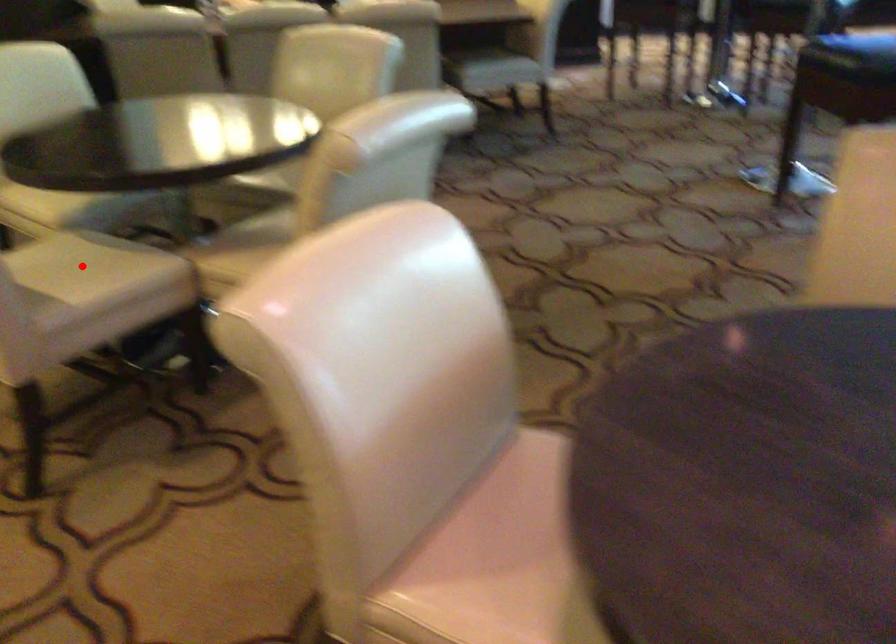
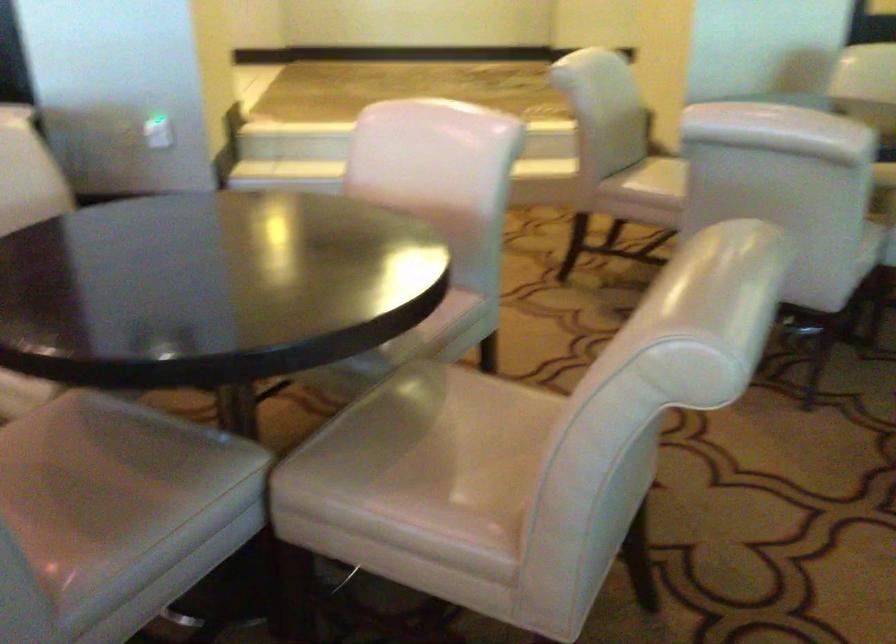
Question: I am providing you with two images of the same scene from different viewpoints. A red point is marked on the first image. Is the red point's position out of view in image 2?

Choices:
 (A) Yes
 (B) No

Answer: (A)